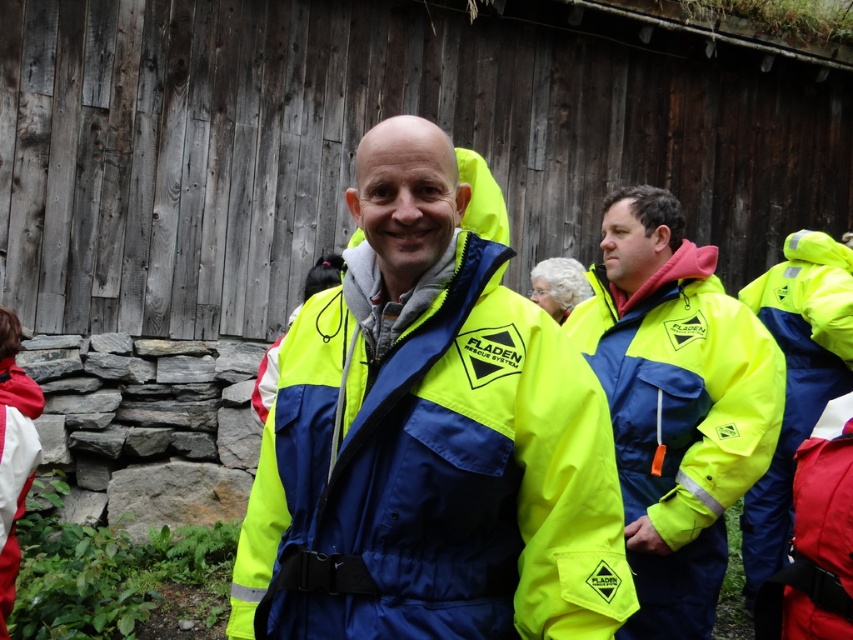
Is neon yellow jacket at center thinner than neon yellow fabric safety vest at right?

In fact, neon yellow jacket at center might be wider than neon yellow fabric safety vest at right.

The height and width of the screenshot is (640, 853). I want to click on neon yellow jacket at center, so click(x=428, y=440).

Can you confirm if neon yellow jacket at center is thinner than matte yellow jacket at right?

No, neon yellow jacket at center is not thinner than matte yellow jacket at right.

Where is `neon yellow jacket at center`? The height and width of the screenshot is (640, 853). neon yellow jacket at center is located at coordinates (428, 440).

Which is below, matte yellow jacket at right or matte red safety vest at lower right?

matte red safety vest at lower right is below.

Between matte yellow jacket at right and matte red safety vest at lower right, which one is positioned higher?

matte yellow jacket at right

Does point (697, 276) lie in front of point (846, 566)?

No.

This screenshot has height=640, width=853. I want to click on matte yellow jacket at right, so click(x=675, y=404).